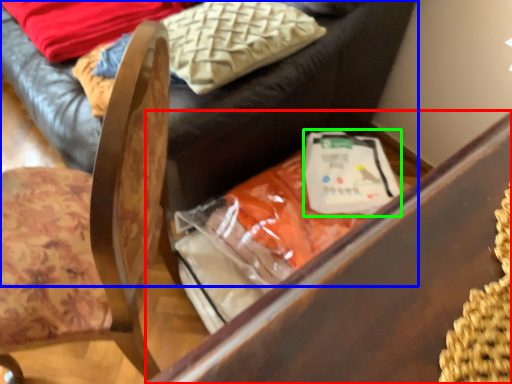
Question: Estimate the real-world distances between objects in this image. Which object is closer to furniture (highlighted by a red box), furniture (highlighted by a blue box) or food (highlighted by a green box)?

Choices:
 (A) furniture
 (B) food

Answer: (A)